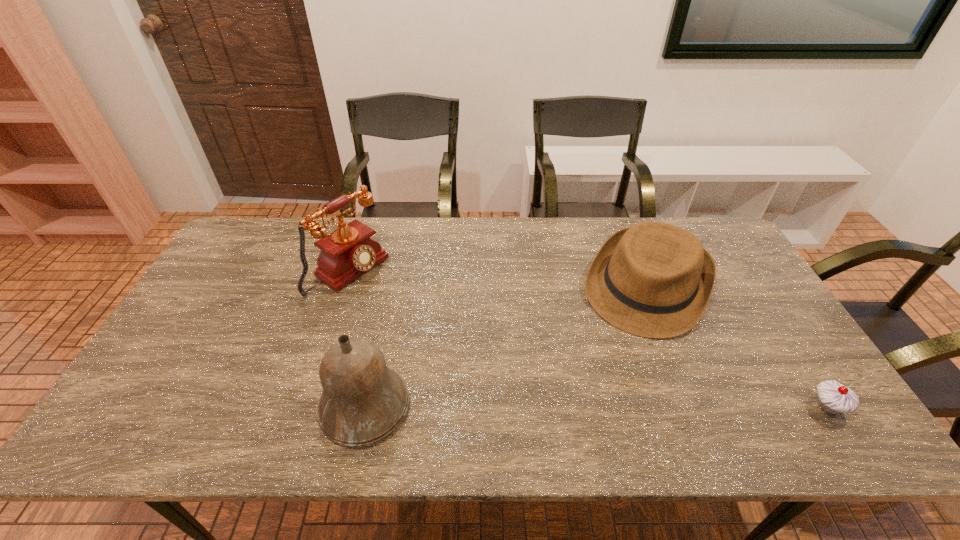
You are a GUI agent. You are given a task and a screenshot of the screen. Output one action in this format:
    pyautogui.click(x=<x>, y=<y>)
    Task: Click on the free space on the desktop that is between the bell and the cupcake and is positioned on the front-facing side of the fedora
    Image resolution: width=960 pixels, height=540 pixels.
    Given the screenshot: What is the action you would take?
    pyautogui.click(x=588, y=407)

You are a GUI agent. You are given a task and a screenshot of the screen. Output one action in this format:
    pyautogui.click(x=<x>, y=<y>)
    Task: Click on the free space on the desktop that is between the bell and the cupcake and is positioned on the dial of the telephone
    
    Given the screenshot: What is the action you would take?
    pyautogui.click(x=550, y=407)